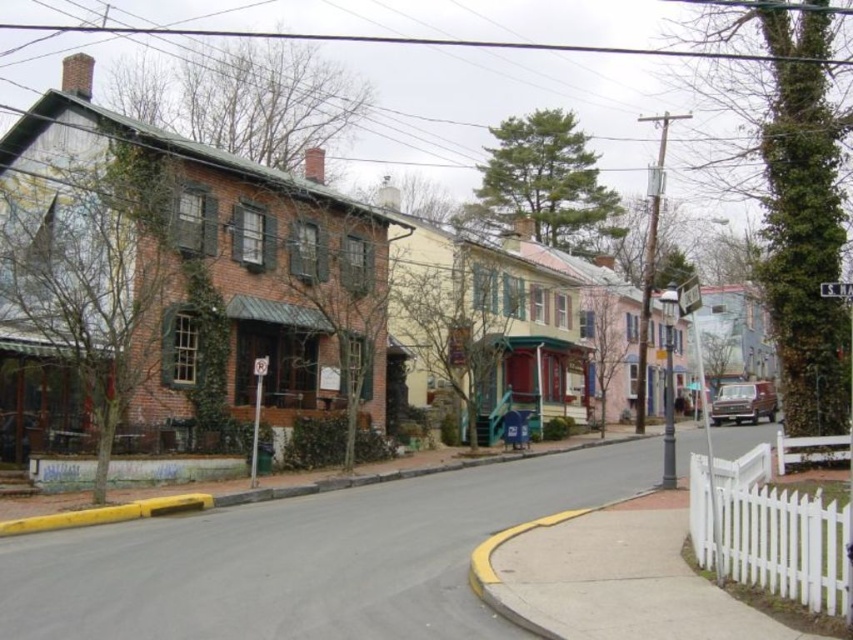
Which of these two, brick building at left or yellow painted curb at lower left, stands shorter?

Standing shorter between the two is yellow painted curb at lower left.

Does brick building at left have a lesser height compared to yellow painted curb at lower left?

Incorrect, brick building at left's height does not fall short of yellow painted curb at lower left's.

Between point (64, 164) and point (227, 493), which one is positioned behind?

Positioned behind is point (64, 164).

Where is `brick building at left`? This screenshot has height=640, width=853. brick building at left is located at coordinates (300, 250).